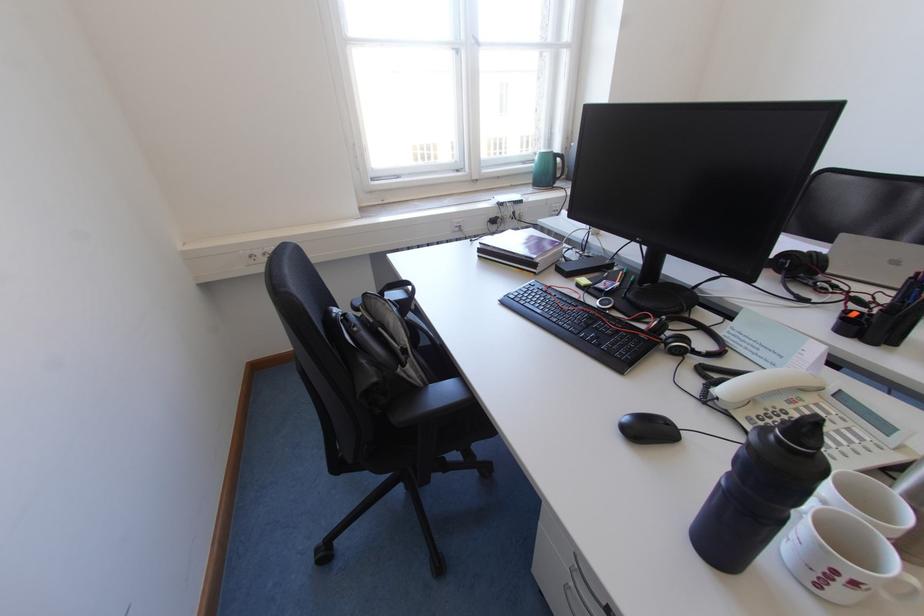
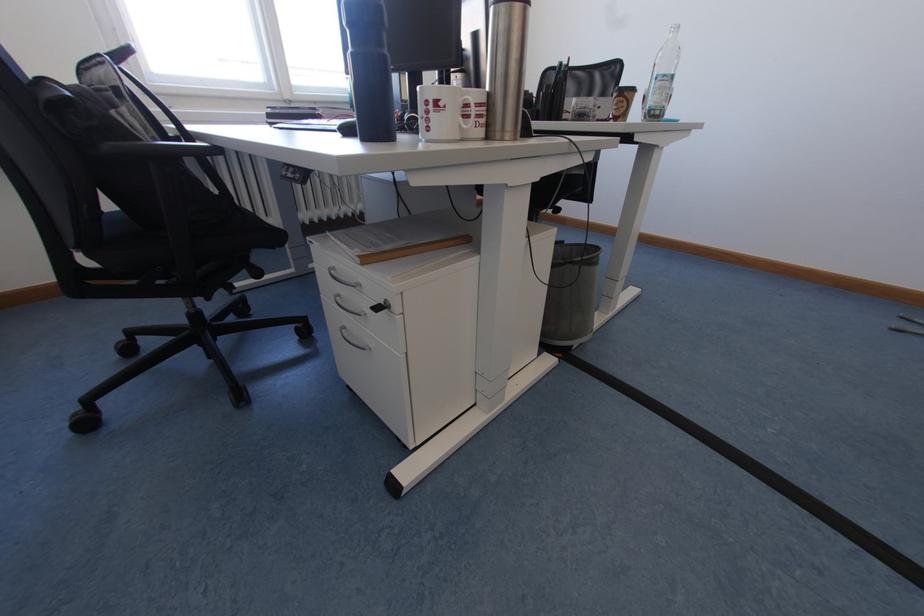
Which direction would the cameraman need to move to produce the second image?

The cameraman walked toward right, backward.